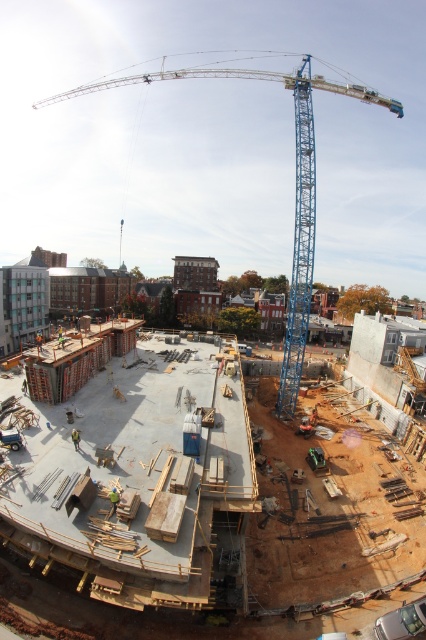
You are a safety inspector at the construction site. You notice the blue metallic crane at upper center and the green fabric construction worker at center. Which object is closer to the crane?

The green fabric construction worker at center is behind the blue metallic crane at upper center, so the crane is closer to the inspector than the worker.

You are a safety inspector at the construction site. You need to ensure that the blue metallic crane at upper center and the green fabric construction worker at center are visible from your vantage point. Which object would appear bigger in your view?

The blue metallic crane at upper center is larger in size than the green fabric construction worker at center, so it would appear bigger in your view.